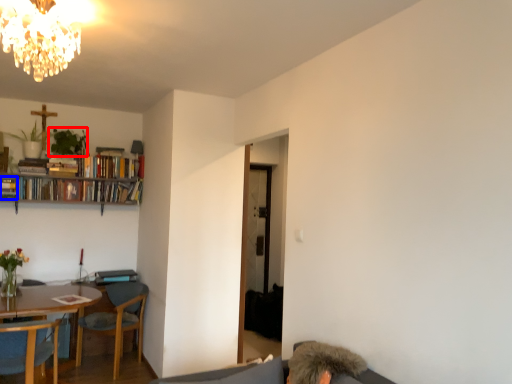
Question: Among these objects, which one is nearest to the camera, plant (highlighted by a red box) or book (highlighted by a blue box)?

Choices:
 (A) plant
 (B) book

Answer: (B)